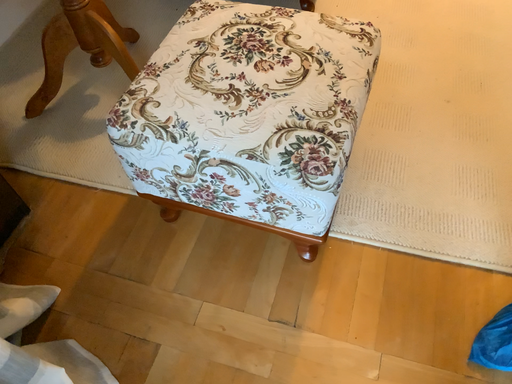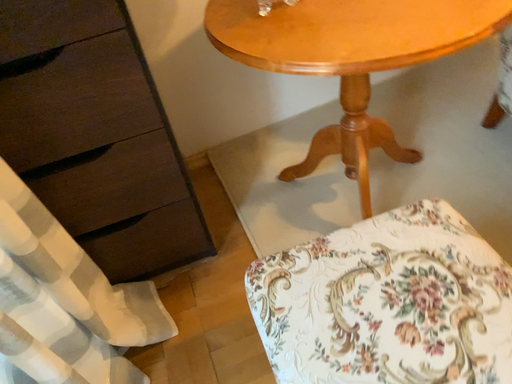
Question: Which way did the camera rotate in the video?

Choices:
 (A) rotated right
 (B) rotated left

Answer: (B)